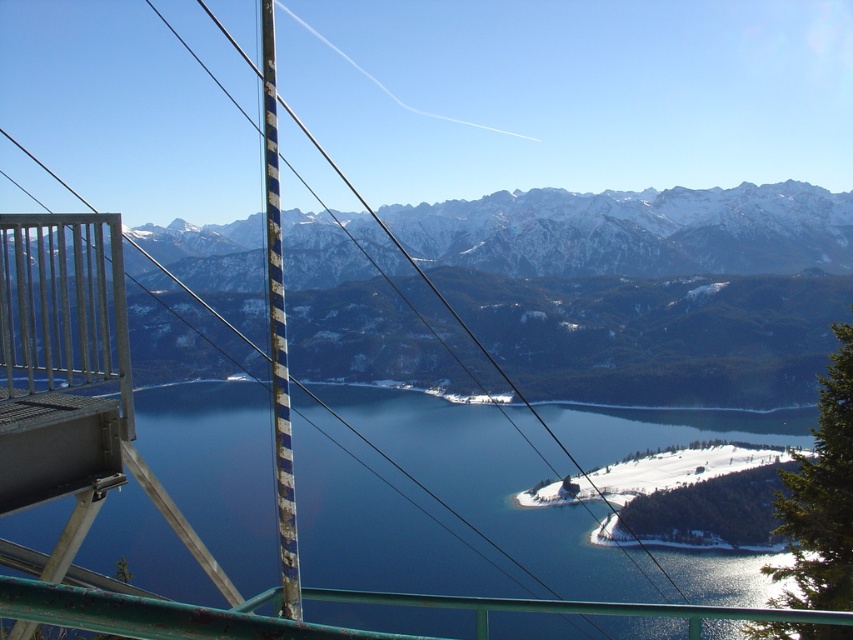
Is blue glassy water at center positioned at the back of white snow ski slope at lower right?

No, blue glassy water at center is closer to the viewer.

Does point (747, 572) come in front of point (585, 499)?

Yes, point (747, 572) is closer to viewer.

The width and height of the screenshot is (853, 640). What do you see at coordinates (494, 488) in the screenshot?
I see `blue glassy water at center` at bounding box center [494, 488].

I want to click on blue glassy water at center, so click(x=494, y=488).

How far apart are snowy mountain range at upper center and white snow ski slope at lower right?

snowy mountain range at upper center is 154.88 meters from white snow ski slope at lower right.

Is snowy mountain range at upper center to the right of white snow ski slope at lower right from the viewer's perspective?

No, snowy mountain range at upper center is not to the right of white snow ski slope at lower right.

Where is `snowy mountain range at upper center`? snowy mountain range at upper center is located at coordinates (659, 307).

The height and width of the screenshot is (640, 853). In order to click on snowy mountain range at upper center in this screenshot , I will do `click(659, 307)`.

Does blue glassy water at center have a lesser height compared to snowy mountain range at upper center?

Correct, blue glassy water at center is not as tall as snowy mountain range at upper center.

Is point (265, 416) in front of point (509, 268)?

Yes, point (265, 416) is in front of point (509, 268).

This screenshot has height=640, width=853. What are the coordinates of `blue glassy water at center` in the screenshot? It's located at (494, 488).